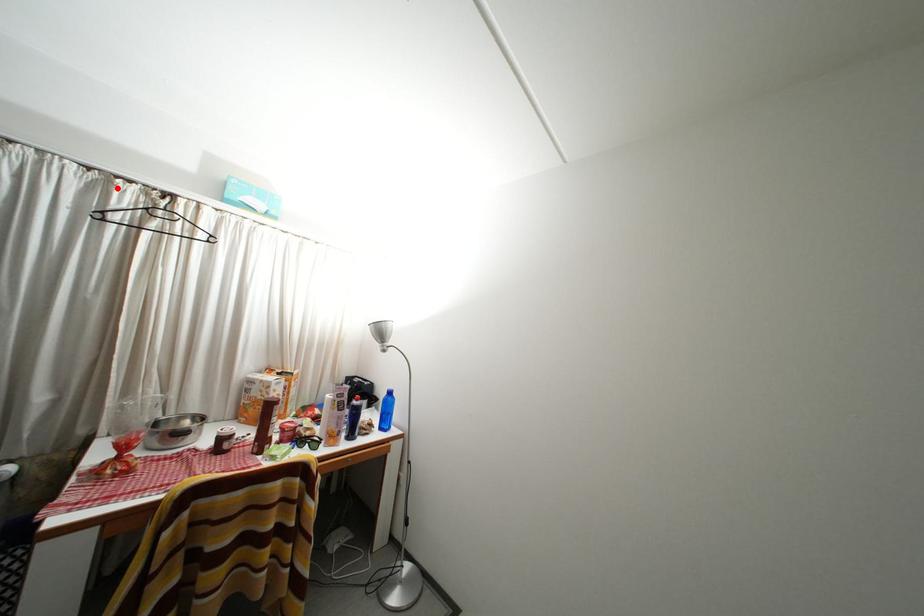
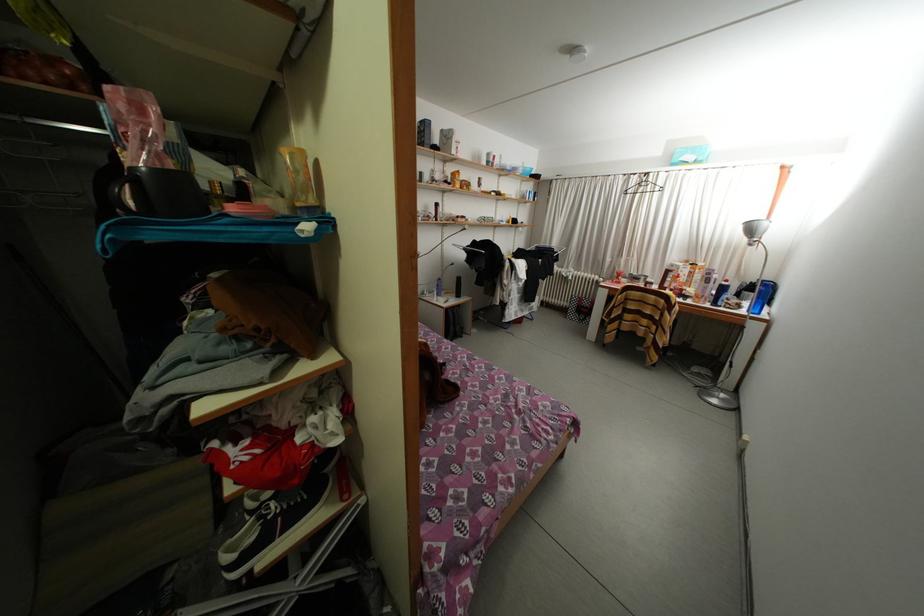
The point at the highlighted location is marked in the first image. Where is the corresponding point in the second image?

(638, 184)